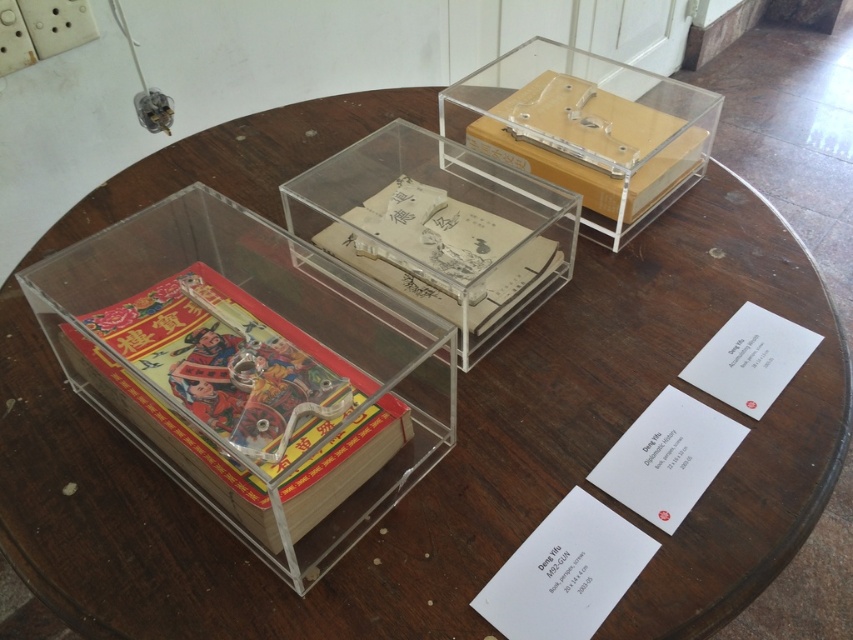
Question: Which point is closer to the camera?

Choices:
 (A) (466, 320)
 (B) (264, 484)

Answer: (B)

Question: In this image, where is red glossy book at center located relative to yellowish paper book at center?

Choices:
 (A) right
 (B) left

Answer: (B)

Question: Does red glossy book at center appear on the left side of yellowish paper book at center?

Choices:
 (A) yes
 (B) no

Answer: (A)

Question: Can you confirm if red glossy book at center is thinner than yellowish paper book at center?

Choices:
 (A) yes
 (B) no

Answer: (B)

Question: Which point is farther from the camera taking this photo?

Choices:
 (A) (364, 436)
 (B) (514, 109)
 (C) (408, 269)

Answer: (B)

Question: Which object appears farthest from the camera in this image?

Choices:
 (A) red glossy book at center
 (B) transparent acrylic box at upper center

Answer: (B)